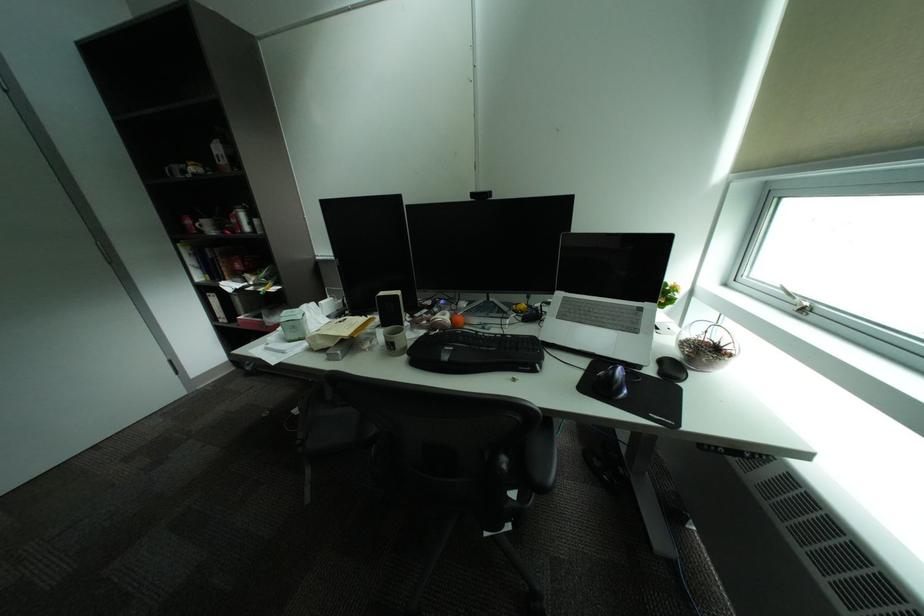
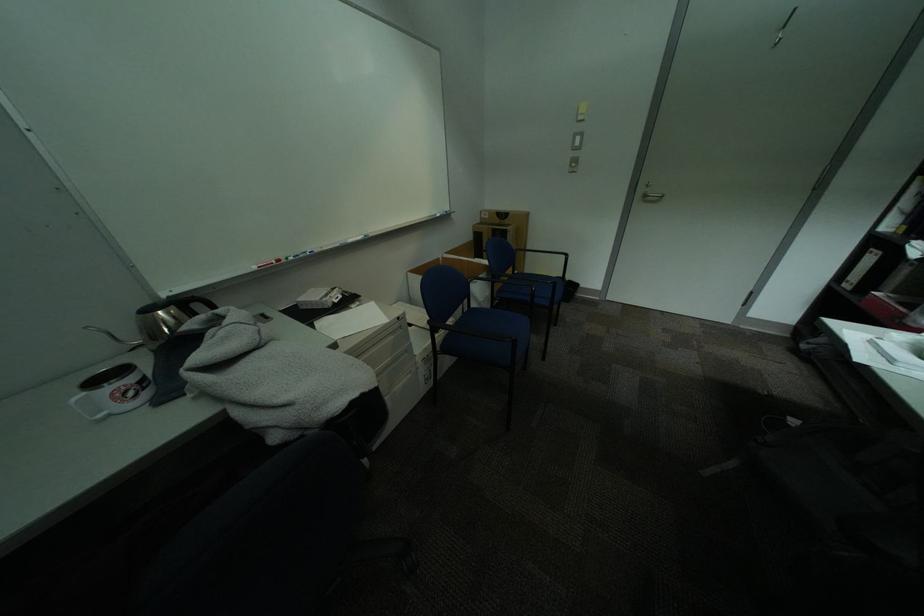
The first image is from the beginning of the video and the second image is from the end. How did the camera likely rotate when shooting the video?

The rotation direction of the camera is left-down.